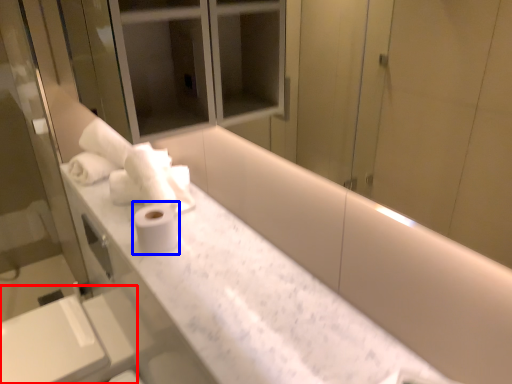
Question: Which object is further to the camera taking this photo, sink (highlighted by a red box) or toilet paper (highlighted by a blue box)?

Choices:
 (A) sink
 (B) toilet paper

Answer: (A)